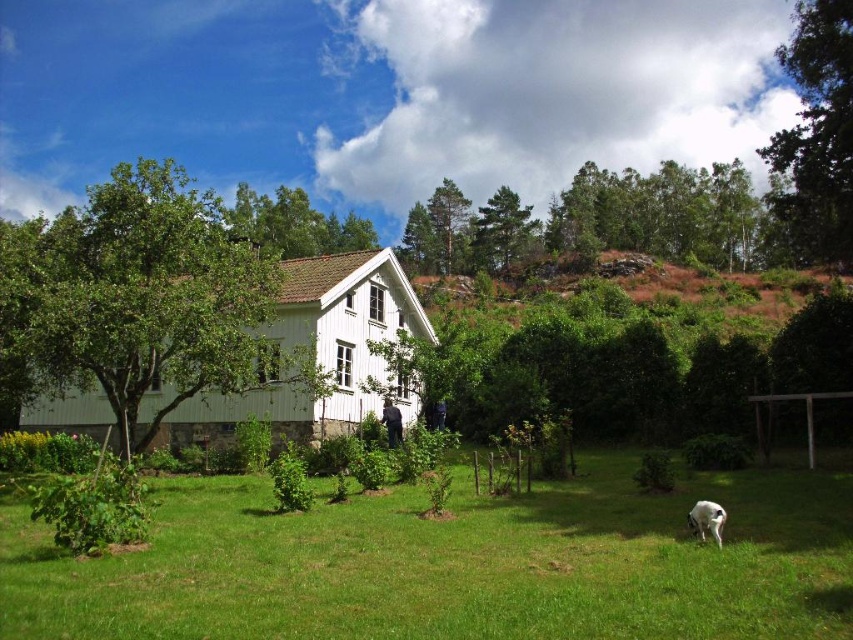
Question: Which point is closer to the camera?

Choices:
 (A) green grass at center
 (B) white fur dog at lower right

Answer: (A)

Question: Is green grass at center to the right of white fur dog at lower right from the viewer's perspective?

Choices:
 (A) yes
 (B) no

Answer: (B)

Question: Considering the relative positions of green grass at center and white fur dog at lower right in the image provided, where is green grass at center located with respect to white fur dog at lower right?

Choices:
 (A) right
 (B) left

Answer: (B)

Question: Is green grass at center thinner than white fur dog at lower right?

Choices:
 (A) yes
 (B) no

Answer: (B)

Question: Which of the following is the farthest from the observer?

Choices:
 (A) green grass at center
 (B) white fur dog at lower right

Answer: (B)